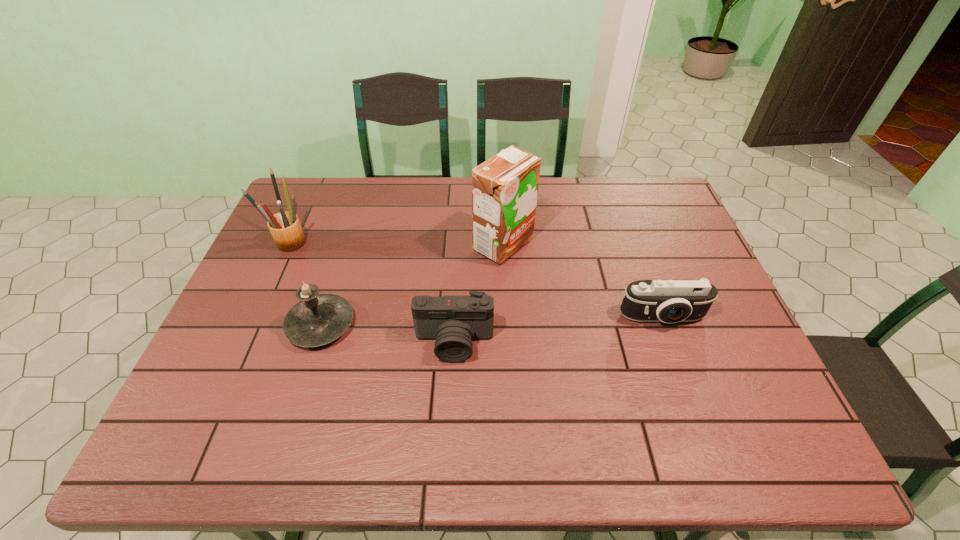
Locate an element on the screen. This screenshot has height=540, width=960. vacant space located 0.060m on the right of the pencil box is located at coordinates (330, 242).

The height and width of the screenshot is (540, 960). Find the location of `free point located 0.330m on the back of the candle`. free point located 0.330m on the back of the candle is located at coordinates (353, 222).

Locate an element on the screen. The height and width of the screenshot is (540, 960). vacant space located on the front lens of the rightmost object is located at coordinates (687, 386).

Where is `blank space located 0.120m at the lens of the left camera`? blank space located 0.120m at the lens of the left camera is located at coordinates 451,410.

The height and width of the screenshot is (540, 960). Find the location of `pencil box situated at the left edge`. pencil box situated at the left edge is located at coordinates (285, 227).

Where is `candle that is at the left edge`? candle that is at the left edge is located at coordinates (318, 319).

You are a GUI agent. You are given a task and a screenshot of the screen. Output one action in this format:
    pyautogui.click(x=<x>, y=<y>)
    Task: Click on the object present at the right edge
    
    Given the screenshot: What is the action you would take?
    pyautogui.click(x=670, y=301)

In the image, there is a desktop. Where is `free space at the far edge`? The image size is (960, 540). free space at the far edge is located at coordinates (560, 186).

You are a GUI agent. You are given a task and a screenshot of the screen. Output one action in this format:
    pyautogui.click(x=<x>, y=<y>)
    Task: Click on the blank space at the near edge of the desktop
    Image resolution: width=960 pixels, height=540 pixels.
    Given the screenshot: What is the action you would take?
    pyautogui.click(x=450, y=434)

Find the location of a particular element. free space at the left edge of the desktop is located at coordinates (246, 397).